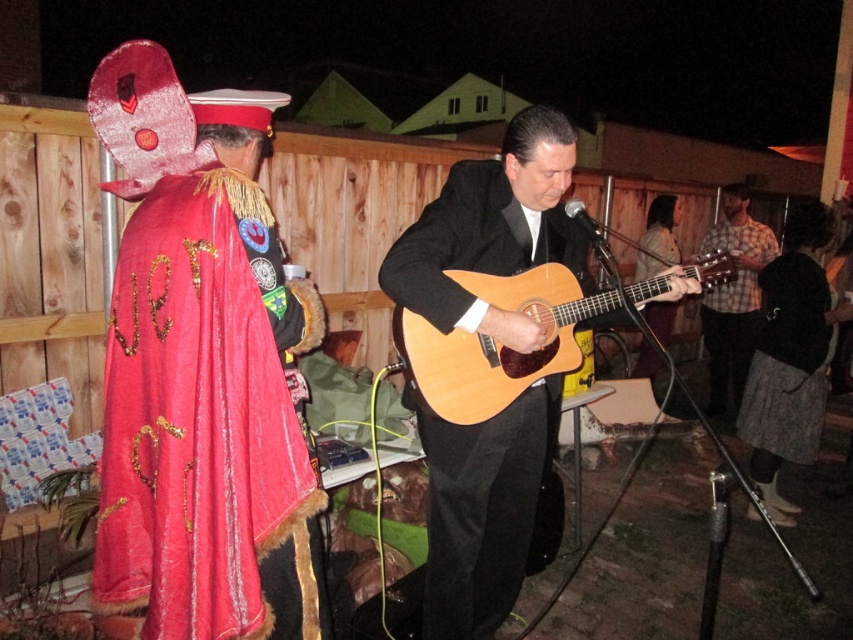
Question: Does matte black suit at center appear on the left side of black woolen sweater at lower right?

Choices:
 (A) yes
 (B) no

Answer: (A)

Question: Can you confirm if velvet red cape at left is bigger than plaid shirt at center?

Choices:
 (A) no
 (B) yes

Answer: (A)

Question: Observing the image, what is the correct spatial positioning of velvet red cape at left in reference to black woolen sweater at lower right?

Choices:
 (A) above
 (B) below

Answer: (A)

Question: Among these points, which one is farthest from the camera?

Choices:
 (A) pyautogui.click(x=753, y=413)
 (B) pyautogui.click(x=456, y=358)
 (C) pyautogui.click(x=453, y=227)
 (D) pyautogui.click(x=320, y=557)

Answer: (A)

Question: Among these objects, which one is farthest from the camera?

Choices:
 (A) velvet red cape at left
 (B) wooden acoustic guitar at center
 (C) matte black suit at center

Answer: (B)

Question: Which object appears farthest from the camera in this image?

Choices:
 (A) matte black suit at center
 (B) natural wood acoustic guitar at center
 (C) velvet red cape at left
 (D) plaid shirt at center

Answer: (D)